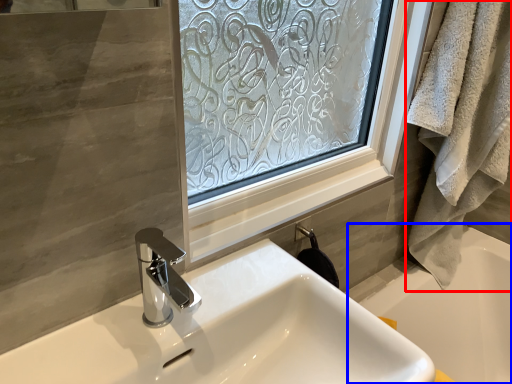
Question: Which point is closer to the camera, bath towel (highlighted by a red box) or bath (highlighted by a blue box)?

Choices:
 (A) bath towel
 (B) bath

Answer: (A)